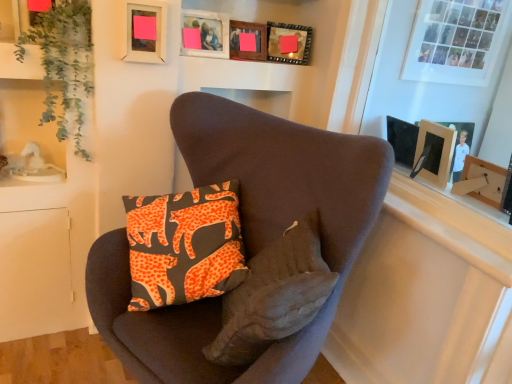
Question: Is the position of wooden picture frame at upper center, the 2th picture frame from the right, more distant than that of matte wooden picture frame at upper center, the 3th picture frame positioned from the right?

Choices:
 (A) no
 (B) yes

Answer: (B)

Question: Does wooden picture frame at upper center, the third picture frame viewed from the left, appear on the left side of matte wooden picture frame at upper center, which is counted as the 2th picture frame, starting from the left?

Choices:
 (A) no
 (B) yes

Answer: (A)

Question: Is the depth of wooden picture frame at upper center, the 2th picture frame from the right, less than that of matte wooden picture frame at upper center, the 3th picture frame positioned from the right?

Choices:
 (A) yes
 (B) no

Answer: (B)

Question: Is wooden picture frame at upper center, the 2th picture frame from the right, bigger than matte wooden picture frame at upper center, which is counted as the 2th picture frame, starting from the left?

Choices:
 (A) yes
 (B) no

Answer: (B)

Question: Is wooden picture frame at upper center, the third picture frame viewed from the left, located outside matte wooden picture frame at upper center, which is counted as the 2th picture frame, starting from the left?

Choices:
 (A) yes
 (B) no

Answer: (A)

Question: Looking at their shapes, would you say wooden picture frame at upper center, marked as the first picture frame in a right-to-left arrangement, is wider or thinner than orange printed fabric pillow at center?

Choices:
 (A) wide
 (B) thin

Answer: (B)

Question: Is point (282, 49) positioned closer to the camera than point (236, 349)?

Choices:
 (A) closer
 (B) farther

Answer: (B)

Question: Relative to orange printed fabric pillow at center, is wooden picture frame at upper center, marked as the first picture frame in a right-to-left arrangement, in front or behind?

Choices:
 (A) behind
 (B) front

Answer: (A)

Question: From a real-world perspective, relative to orange printed fabric pillow at center, is wooden picture frame at upper center, marked as the first picture frame in a right-to-left arrangement, vertically above or below?

Choices:
 (A) above
 (B) below

Answer: (A)

Question: Is matte wooden picture frame at upper center, which is counted as the 2th picture frame, starting from the left, in front of or behind wooden picture frame at upper center, the third picture frame viewed from the left, in the image?

Choices:
 (A) behind
 (B) front

Answer: (B)

Question: Is matte wooden picture frame at upper center, which is counted as the 2th picture frame, starting from the left, bigger or smaller than wooden picture frame at upper center, the third picture frame viewed from the left?

Choices:
 (A) big
 (B) small

Answer: (A)

Question: From a real-world perspective, is matte wooden picture frame at upper center, which is counted as the 2th picture frame, starting from the left, above or below wooden picture frame at upper center, the 2th picture frame from the right?

Choices:
 (A) below
 (B) above

Answer: (B)

Question: Looking at their shapes, would you say matte wooden picture frame at upper center, the 3th picture frame positioned from the right, is wider or thinner than wooden picture frame at upper center, the third picture frame viewed from the left?

Choices:
 (A) thin
 (B) wide

Answer: (B)

Question: Considering the positions of green leafy plant at upper left and velvet brown armchair at center in the image, is green leafy plant at upper left bigger or smaller than velvet brown armchair at center?

Choices:
 (A) small
 (B) big

Answer: (A)

Question: Is green leafy plant at upper left spatially inside velvet brown armchair at center, or outside of it?

Choices:
 (A) inside
 (B) outside

Answer: (B)